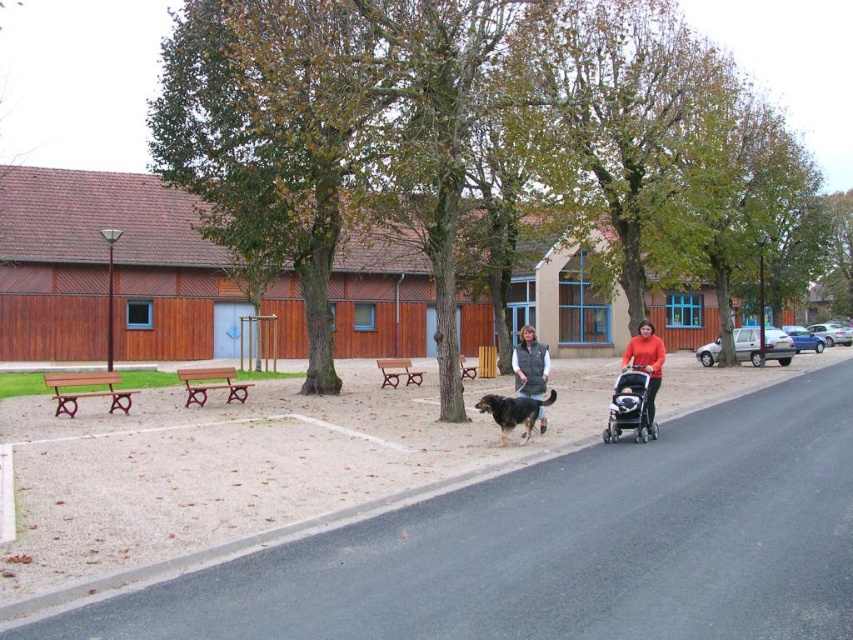
The image size is (853, 640). What do you see at coordinates (646, 364) in the screenshot?
I see `matte orange sweater at center` at bounding box center [646, 364].

Is matte orange sweater at center positioned before brown fur dog at lower center?

No.

Find the location of `matte orange sweater at center`. matte orange sweater at center is located at coordinates (646, 364).

Looking at this image, does silver metallic stroller at right have a lesser width compared to matte orange sweater at center?

Correct, silver metallic stroller at right's width is less than matte orange sweater at center's.

Between silver metallic stroller at right and matte orange sweater at center, which one has more height?

Standing taller between the two is matte orange sweater at center.

Locate an element on the screen. The width and height of the screenshot is (853, 640). silver metallic stroller at right is located at coordinates (631, 406).

Identify the location of silver metallic stroller at right. Image resolution: width=853 pixels, height=640 pixels. (631, 406).

Does silver metallic stroller at right have a smaller size compared to dark gray fleece vest at center?

Yes, silver metallic stroller at right is smaller than dark gray fleece vest at center.

Is silver metallic stroller at right below dark gray fleece vest at center?

Indeed, silver metallic stroller at right is positioned under dark gray fleece vest at center.

Between point (639, 392) and point (514, 369), which one is positioned in front?

Point (639, 392)

Where is `silver metallic stroller at right`? The width and height of the screenshot is (853, 640). silver metallic stroller at right is located at coordinates (631, 406).